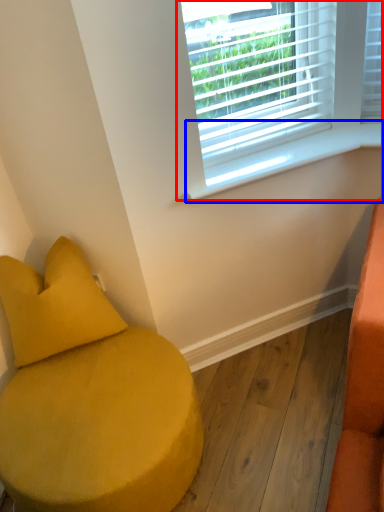
Question: Which object appears closest to the camera in this image, window (highlighted by a red box) or window sill (highlighted by a blue box)?

Choices:
 (A) window
 (B) window sill

Answer: (A)